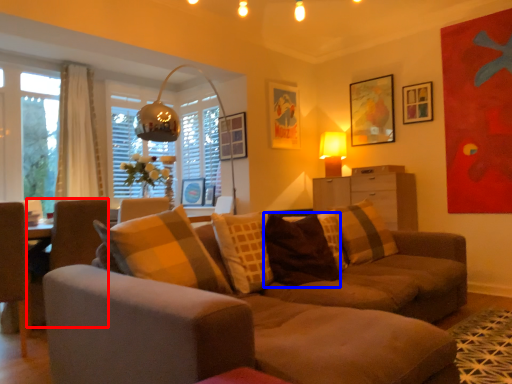
Question: Among these objects, which one is nearest to the camera, swivel chair (highlighted by a red box) or pillow (highlighted by a blue box)?

Choices:
 (A) swivel chair
 (B) pillow

Answer: (A)